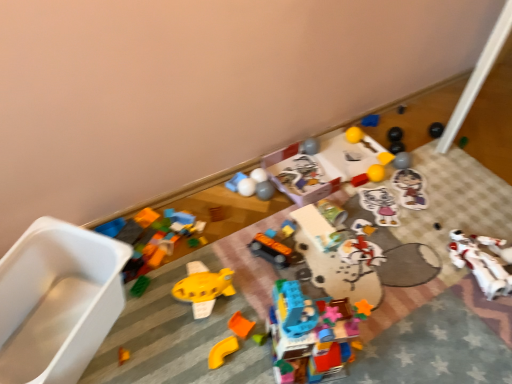
Locate an element on the screen. free space that is in between orange matte plastic toy at lower center, the fifteenth toy viewed from the right, and white plastic container at left, the seventeenth toy when ordered from right to left is located at coordinates (160, 347).